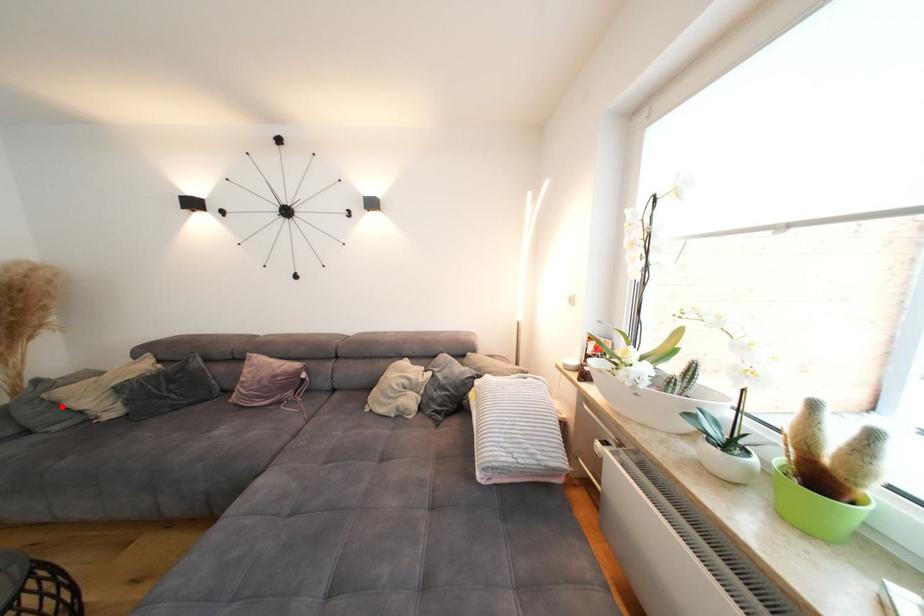
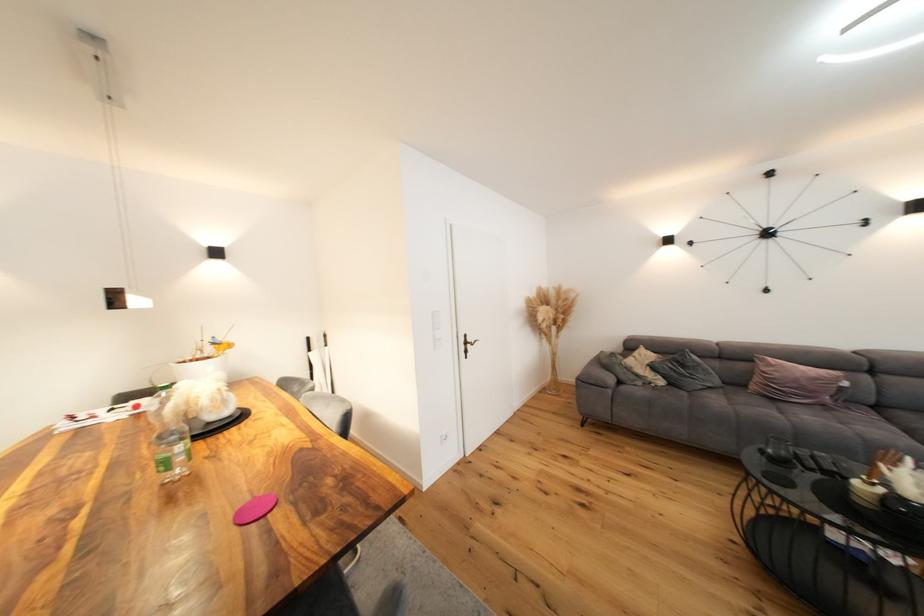
Question: I am providing you with two images of the same scene from different viewpoints. Image1 has a red point marked. In image2, the corresponding 3D location appears at what relative position? Reply with the corresponding letter.

Choices:
 (A) Closer
 (B) Farther

Answer: (B)